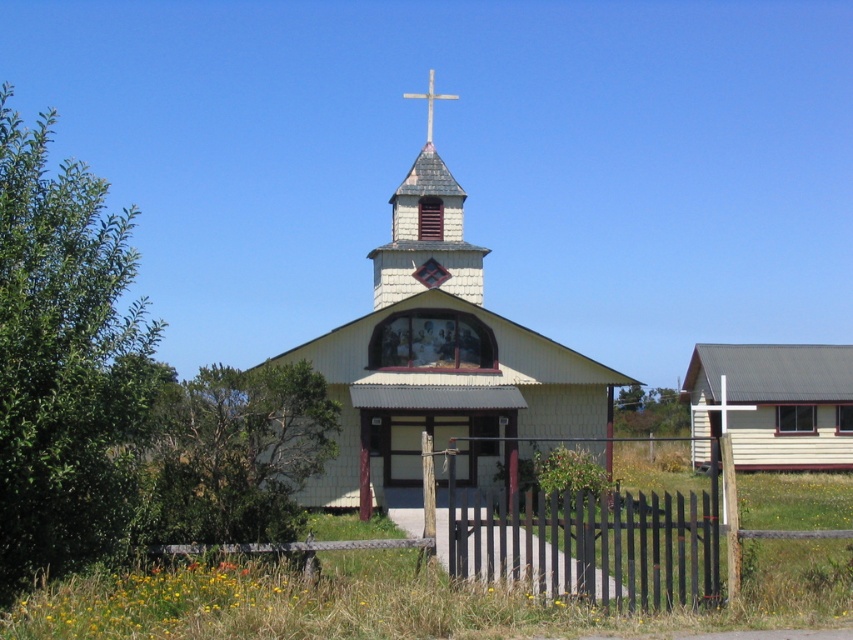
You are standing in front of the church and want to enter through the entrance. Which object, the black wood fence at center or the wooden cross at upper center, is closer to the entrance?

The black wood fence at center is positioned on the right side of the wooden cross at upper center, meaning the wooden cross at upper center is closer to the entrance than the black wood fence at center.

You are standing in front of the church and notice two points marked on the building. The first point is at coordinates point (534, 339) and the second is at point (722, 410). Which point is closer to you?

Point (534, 339) is in front of point (722, 410), so it is closer to you.